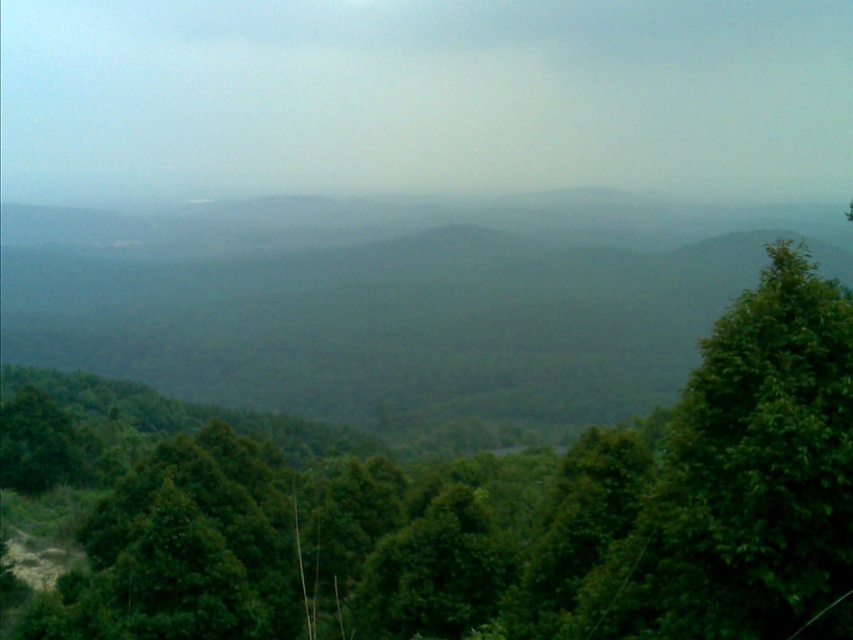
You are standing at the point labeled point (436, 264) and want to walk towards the point labeled point (778, 580). Given the landscape described, will you be moving towards the foreground or the background?

Moving towards point (778, 580) from point (436, 264) means you are moving towards the foreground because point (778, 580) is in front of point (436, 264).

You are hiking through the forest and want to take a photo of both the green leafy tree at center and the green leafy forest at center. Which one should you focus on first to ensure both are in sharp focus?

You should focus on the green leafy tree at center first since it is closer to you than the green leafy forest at center. By focusing on the closer object, the farther one will also be in focus due to the depth of field.

You are a park ranger assessing the landscape. You notice the green leafy tree at center and the green leafy forest at center. Which one has a smaller width?

The green leafy tree at center has a smaller width than the green leafy forest at center.